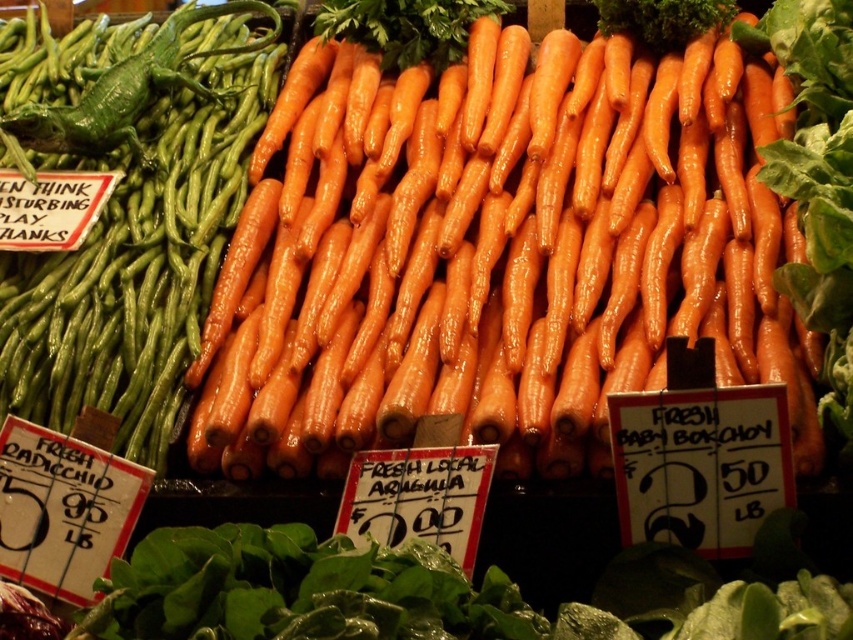
Question: Does orange smooth carrots at center appear under green matte string beans at upper left?

Choices:
 (A) no
 (B) yes

Answer: (B)

Question: Estimate the real-world distances between objects in this image. Which object is closer to the green matte string beans at upper left?

Choices:
 (A) green glossy beans at upper left
 (B) orange smooth carrots at center

Answer: (A)

Question: Which object appears closest to the camera in this image?

Choices:
 (A) green matte string beans at upper left
 (B) green glossy beans at upper left

Answer: (B)

Question: Is orange smooth carrots at center positioned behind green glossy beans at upper left?

Choices:
 (A) no
 (B) yes

Answer: (A)

Question: From the image, what is the correct spatial relationship of green glossy beans at upper left in relation to green matte string beans at upper left?

Choices:
 (A) right
 (B) left

Answer: (B)

Question: Which object is farther from the camera taking this photo?

Choices:
 (A) green matte string beans at upper left
 (B) orange smooth carrots at center

Answer: (A)